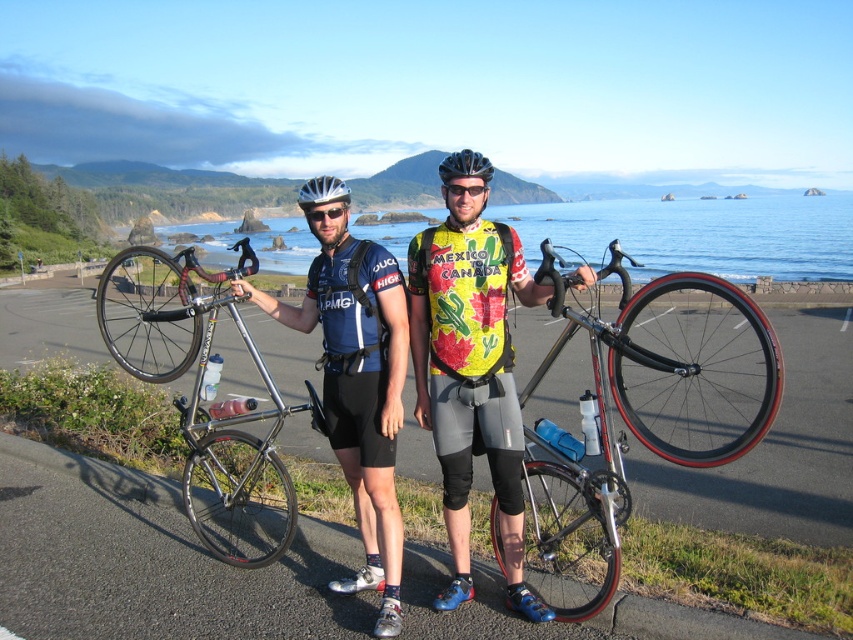
You are a photographer standing in front of the two cyclists. You need to take a photo that includes both the shiny silver bicycle at center and the black matte bicycle helmet at center. According to the scene description, which object should you adjust to ensure both are in the frame?

The shiny silver bicycle at center is positioned on the right side of the black matte bicycle helmet at center. To include both in the photo, you should move the shiny silver bicycle at center to the left or move the black matte bicycle helmet at center to the right so they are closer together.

You are a photographer positioned behind the cyclists and want to capture both the matte black cycling jersey at center and the silver metallic helmet at center in your shot. Which object will appear closer to the camera in the photo?

The matte black cycling jersey at center will appear closer to the camera because it is in front of the silver metallic helmet at center.

You are a photographer trying to capture the shiny silver bicycle at center in your shot. The camera you are using has a limited field of view. Based on the scene description, can you confirm if the shiny silver bicycle at center is positioned at the coordinates point (639,413)?

Yes, the shiny silver bicycle at center is located at point (639,413) according to the description.